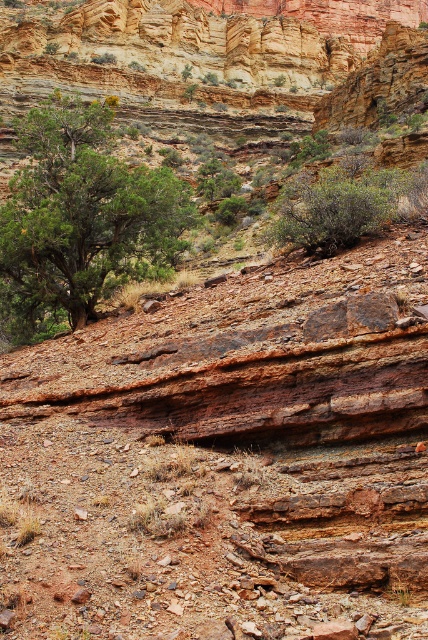
You are a hiker who needs to set up a campsite between the green leafy tree at left and the green leafy bush at center. The recommended safe distance for camping from any vegetation is at least 5 meters to prevent fire hazards. Can you safely set up your campsite between these two plants?

The green leafy tree at left is 15.08 meters away from the green leafy bush at center. Since the minimum safe distance required is 5 meters, you can safely set up your campsite between them as long as you maintain at least 5 meters from each plant.

You are navigating a desert terrain and need to reach a hidden oasis. You see two landmarks marked as point coordinates on your map. Which point is closer to you, point (89, 314) or point (321, 212)?

Point (89, 314) is closer to you because it is further to the viewer than point (321, 212).